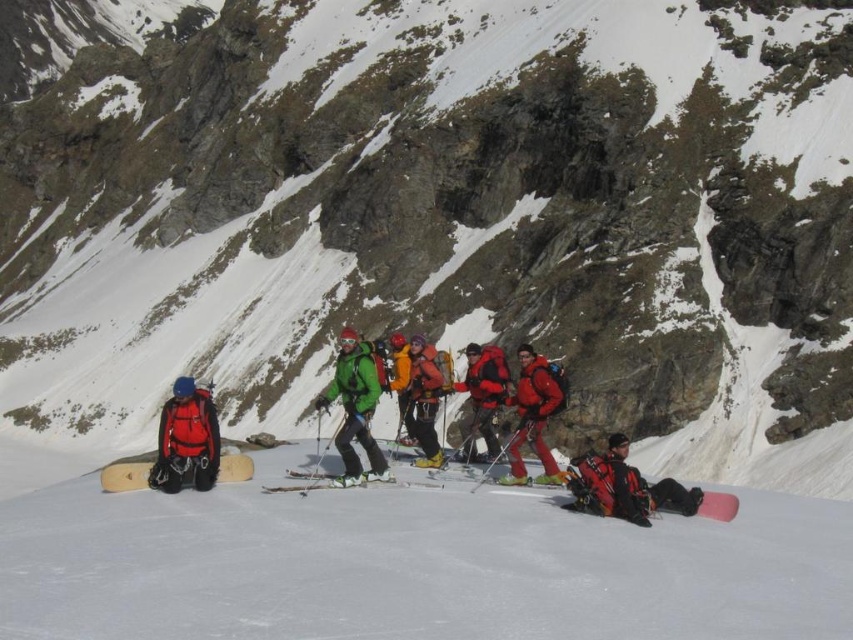
From the picture: You are planning to carry both the red matte backpack at left and the yellow matte jacket at center during a hike. Which item can hold more items based on their size?

The red matte backpack at left is bigger than the yellow matte jacket at center, so it can hold more items.

You are planning to take a photo of the red matte backpack at left and the yellow matte jacket at center. To ensure both are in focus, you need to know their relative heights. Which one is shorter?

The red matte backpack at left is shorter than the yellow matte jacket at center.

You are standing on the mountain slope and want to move from the point closer to you to the point further away. Which path would you take between the two points, point (x=195, y=392) or point (x=403, y=406)?

You should take the path to point (x=403, y=406) because it is further away from you compared to point (x=195, y=392) which is closer.